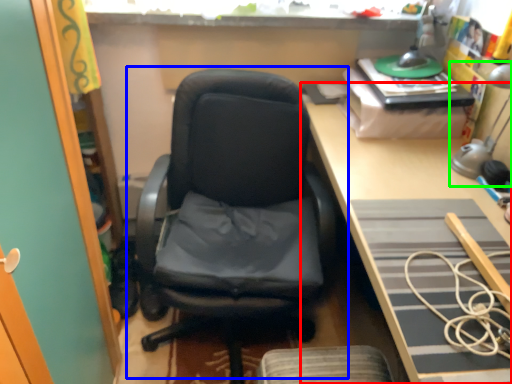
Question: Considering the real-world distances, which object is closest to desk (highlighted by a red box)? chair (highlighted by a blue box) or table lamp (highlighted by a green box).

Choices:
 (A) chair
 (B) table lamp

Answer: (B)